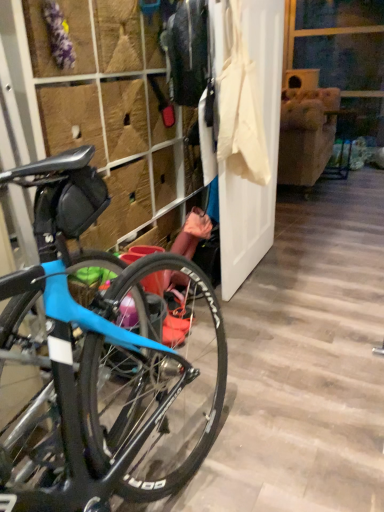
Where is `blue matte bicycle at left`? This screenshot has height=512, width=384. blue matte bicycle at left is located at coordinates (117, 122).

The image size is (384, 512). What do you see at coordinates (117, 122) in the screenshot?
I see `blue matte bicycle at left` at bounding box center [117, 122].

In order to face white fabric screen door at center, should I rotate leftwards or rightwards?

Rotate right and turn 8.054 degrees.

Locate an element on the screen. This screenshot has height=512, width=384. white fabric screen door at center is located at coordinates (267, 149).

Describe the element at coordinates (267, 149) in the screenshot. I see `white fabric screen door at center` at that location.

What are the coordinates of `blue matte bicycle at left` in the screenshot? It's located at (117, 122).

Which object is positioned more to the left, blue matte bicycle at left or white fabric screen door at center?

Positioned to the left is blue matte bicycle at left.

Is the depth of blue matte bicycle at left greater than that of white fabric screen door at center?

No, the depth of blue matte bicycle at left is less than that of white fabric screen door at center.

Which is nearer, [72,87] or [247,208]?

Clearly, point [72,87] is closer to the camera than point [247,208].

From the image's perspective, which one is positioned higher, blue matte bicycle at left or white fabric screen door at center?

white fabric screen door at center appears higher in the image.

From a real-world perspective, which object stands above the other?

blue matte bicycle at left, from a real-world perspective.

In terms of width, does blue matte bicycle at left look wider or thinner when compared to white fabric screen door at center?

blue matte bicycle at left is wider than white fabric screen door at center.

Does blue matte bicycle at left have a lesser height compared to white fabric screen door at center?

No.

In terms of size, does blue matte bicycle at left appear bigger or smaller than white fabric screen door at center?

Considering their sizes, blue matte bicycle at left takes up more space than white fabric screen door at center.

Do you think blue matte bicycle at left is within white fabric screen door at center, or outside of it?

blue matte bicycle at left is not enclosed by white fabric screen door at center.

Looking at this image, is blue matte bicycle at left in contact with white fabric screen door at center?

blue matte bicycle at left and white fabric screen door at center are not in contact.

Is blue matte bicycle at left looking in the opposite direction of white fabric screen door at center?

Yes, white fabric screen door at center is at the back of blue matte bicycle at left.

Can you tell me how much blue matte bicycle at left and white fabric screen door at center differ in facing direction?

1.26 degrees.

Locate an element on the screen. This screenshot has width=384, height=512. closet in front of the white fabric screen door at center is located at coordinates (117, 122).

Considering the relative positions of white fabric screen door at center and blue matte bicycle at left in the image provided, is white fabric screen door at center to the right of blue matte bicycle at left from the viewer's perspective?

Correct, you'll find white fabric screen door at center to the right of blue matte bicycle at left.

Is the position of white fabric screen door at center less distant than that of blue matte bicycle at left?

That is False.

Does point (267, 52) come in front of point (234, 260)?

Yes, point (267, 52) is in front of point (234, 260).

From the image's perspective, which is below, white fabric screen door at center or blue matte bicycle at left?

From the image's view, blue matte bicycle at left is below.

From a real-world perspective, which is physically above, white fabric screen door at center or blue matte bicycle at left?

blue matte bicycle at left is physically above.

Does white fabric screen door at center have a greater width compared to blue matte bicycle at left?

No.

Can you confirm if white fabric screen door at center is taller than blue matte bicycle at left?

No, white fabric screen door at center is not taller than blue matte bicycle at left.

Which of these two, white fabric screen door at center or blue matte bicycle at left, is bigger?

blue matte bicycle at left.

Can blue matte bicycle at left be found inside white fabric screen door at center?

No, white fabric screen door at center does not contain blue matte bicycle at left.

Is white fabric screen door at center next to blue matte bicycle at left and touching it?

No, white fabric screen door at center is not touching blue matte bicycle at left.

Is white fabric screen door at center aimed at blue matte bicycle at left?

No, white fabric screen door at center is not aimed at blue matte bicycle at left.

Can you tell me how much white fabric screen door at center and blue matte bicycle at left differ in facing direction?

They differ by 1.26 degrees in their facing directions.

How distant is white fabric screen door at center from blue matte bicycle at left?

white fabric screen door at center is 19.04 inches away from blue matte bicycle at left.

The width and height of the screenshot is (384, 512). What are the coordinates of `closet on the left of white fabric screen door at center` in the screenshot? It's located at (117, 122).

This screenshot has width=384, height=512. I want to click on closet on the left of white fabric screen door at center, so click(117, 122).

Where is `screen door behind the blue matte bicycle at left`? This screenshot has width=384, height=512. screen door behind the blue matte bicycle at left is located at coordinates (267, 149).